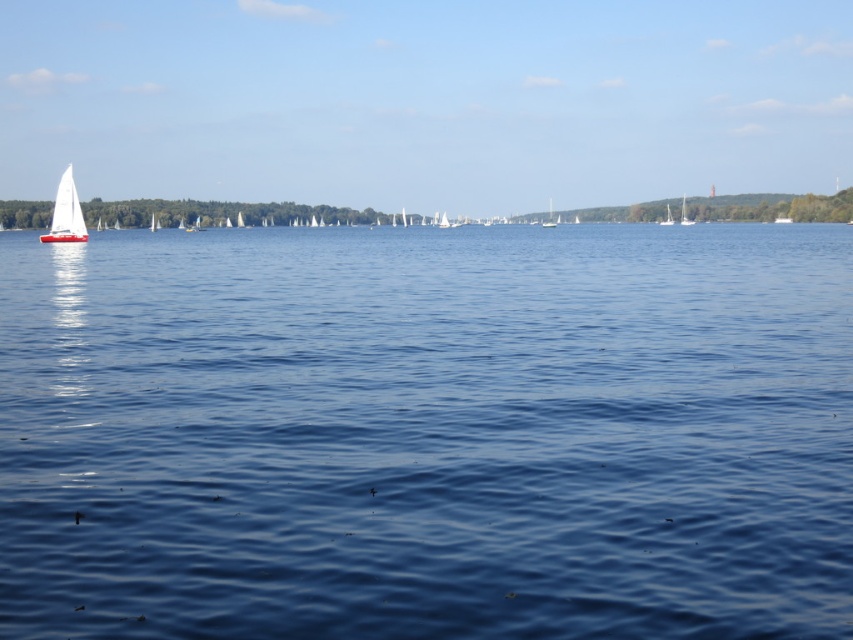
You are a photographer planning to capture the blue water at center and the white matte sailboat at left in a single shot. Given their sizes, which object will occupy more space in your photo?

The blue water at center will occupy more space in the photo because it has a larger size compared to the white matte sailboat at left.